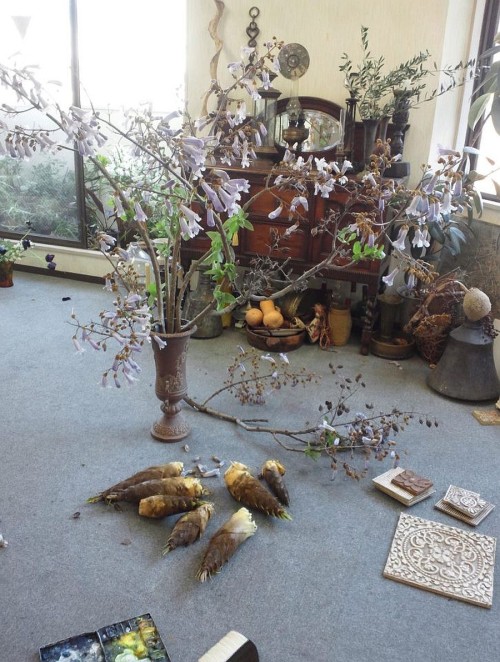
Image resolution: width=500 pixels, height=662 pixels. Find the location of `wooden credenza`. wooden credenza is located at coordinates (261, 204).